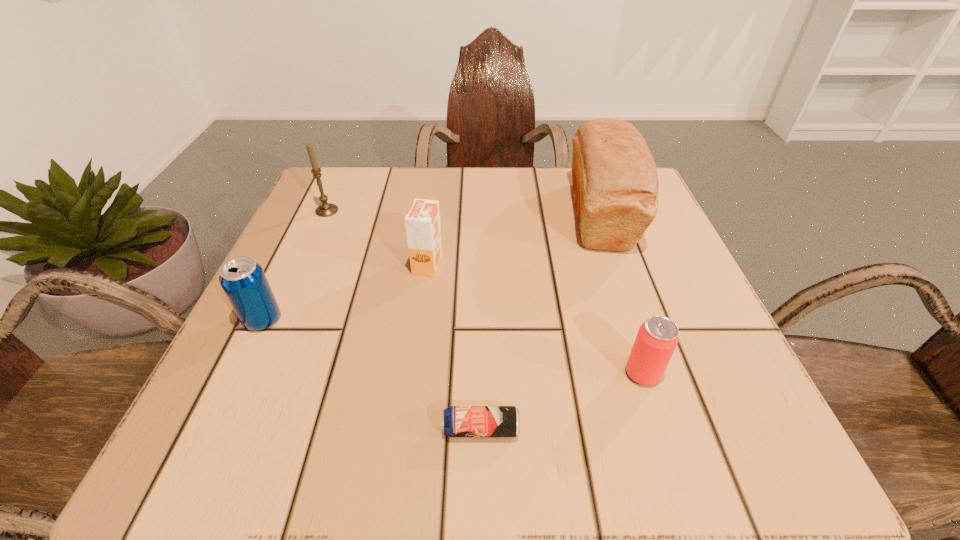
Identify the location of bread. (615, 184).

This screenshot has width=960, height=540. I want to click on candle, so click(x=325, y=209).

Image resolution: width=960 pixels, height=540 pixels. Identify the location of orange juice. (423, 230).

Find the location of a particular element. pop soda is located at coordinates point(243,280).

Find the location of `the farther beer can`. the farther beer can is located at coordinates (657, 338).

The image size is (960, 540). Find the location of `the right beer can`. the right beer can is located at coordinates (657, 338).

At what (x,y) coordinates should I click in order to perform the action: click on the shorter beer can. Please return your answer as a coordinate pair (x, y). This screenshot has height=540, width=960. Looking at the image, I should click on (458, 421).

Locate an element on the screen. The width and height of the screenshot is (960, 540). the nearest object is located at coordinates pyautogui.click(x=458, y=421).

Find the location of `vacant space located on the front of the bread`. vacant space located on the front of the bread is located at coordinates (679, 443).

Image resolution: width=960 pixels, height=540 pixels. Find the location of `vacant space located 0.290m on the front of the candle`. vacant space located 0.290m on the front of the candle is located at coordinates (276, 325).